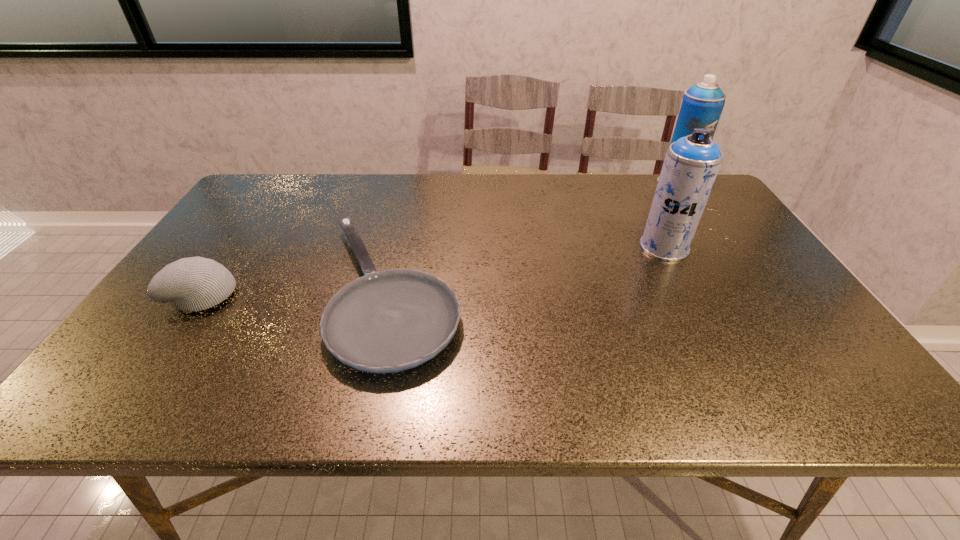
At what (x,y) coordinates should I click in order to perform the action: click on free space between the shortest object and the nearer aerosol can. Please return your answer as a coordinate pair (x, y). Image resolution: width=960 pixels, height=540 pixels. Looking at the image, I should click on (527, 269).

Locate an element on the screen. This screenshot has width=960, height=540. vacant space in between the leftmost object and the nearer aerosol can is located at coordinates (433, 271).

What are the coordinates of `vacant area that lies between the rightmost object and the beanie` in the screenshot? It's located at (440, 239).

Locate an element on the screen. Image resolution: width=960 pixels, height=540 pixels. vacant region between the left aerosol can and the beanie is located at coordinates (433, 271).

I want to click on free spot between the third tallest object and the frying pan, so coord(297,293).

I want to click on vacant space that's between the second shortest object and the frying pan, so click(297, 293).

The width and height of the screenshot is (960, 540). I want to click on empty space that is in between the farther aerosol can and the second object from left to right, so click(x=534, y=238).

What are the coordinates of `free space between the right aerosol can and the leftmost object` in the screenshot? It's located at (440, 239).

Identify which object is located as the third nearest to the farthest object. Please provide its 2D coordinates. Your answer should be formatted as a tuple, i.e. [(x, y)], where the tuple contains the x and y coordinates of a point satisfying the conditions above.

[(191, 284)]

The width and height of the screenshot is (960, 540). In order to click on object that is the second closest to the second shortest object in this screenshot , I will do `click(691, 164)`.